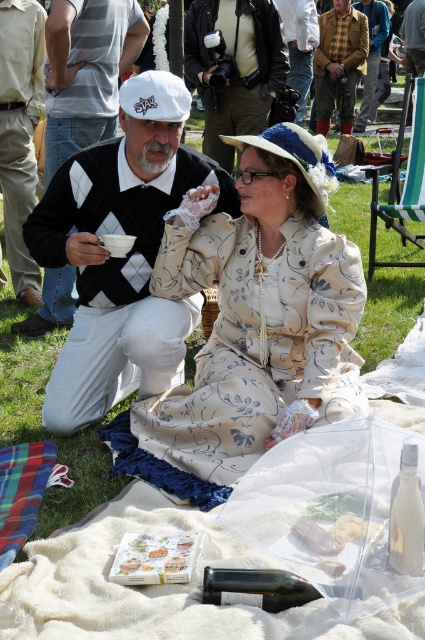
Question: Which point is closer to the camera?

Choices:
 (A) (212, 115)
 (B) (31, 6)
 (C) (374, 12)

Answer: (B)

Question: Can you confirm if beige floral dress at center is bigger than yellow wool sweater at center?

Choices:
 (A) no
 (B) yes

Answer: (A)

Question: Which object is closer to the camera taking this photo?

Choices:
 (A) argyle sweater at center
 (B) plaid wool jacket at center
 (C) matte black camera at upper center
 (D) khaki cotton pants at lower left

Answer: (A)

Question: Where is khaki cotton pants at lower left located in relation to printed paper napkin at lower center in the image?

Choices:
 (A) below
 (B) above

Answer: (B)

Question: Observing the image, what is the correct spatial positioning of khaki cotton pants at lower left in reference to printed paper napkin at lower center?

Choices:
 (A) below
 (B) above

Answer: (B)

Question: Which object is positioned closest to the argyle sweater at center?

Choices:
 (A) plaid wool jacket at center
 (B) khaki cotton pants at lower left
 (C) beige floral dress at center

Answer: (C)